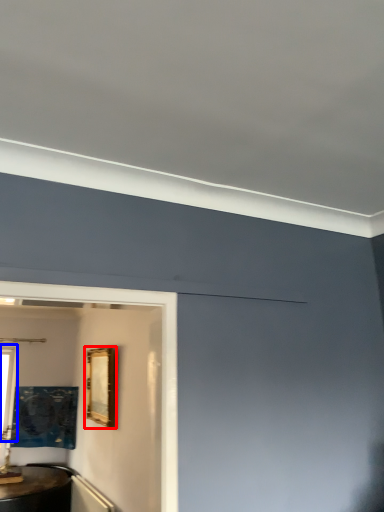
Question: Which object appears closest to the camera in this image, picture frame (highlighted by a red box) or window (highlighted by a blue box)?

Choices:
 (A) picture frame
 (B) window

Answer: (A)